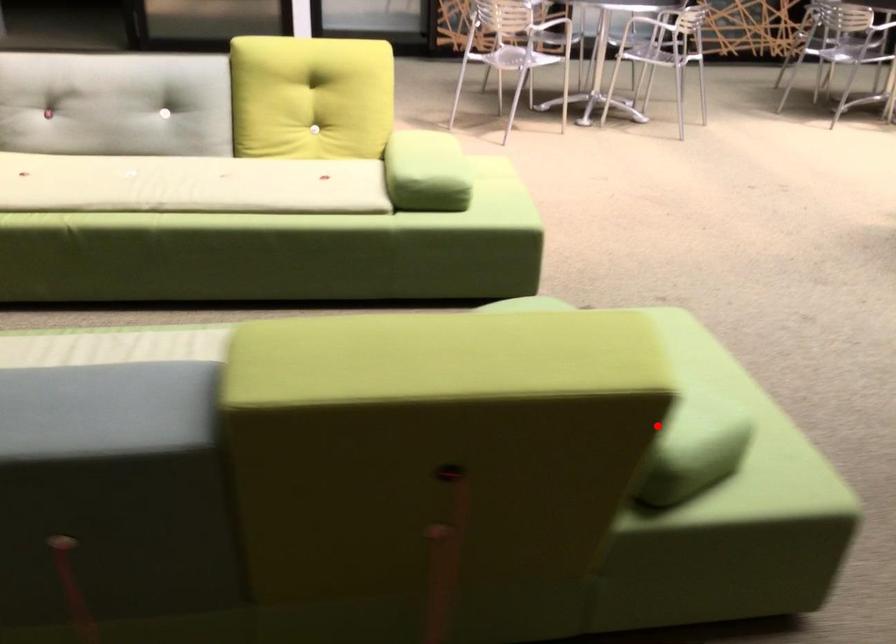
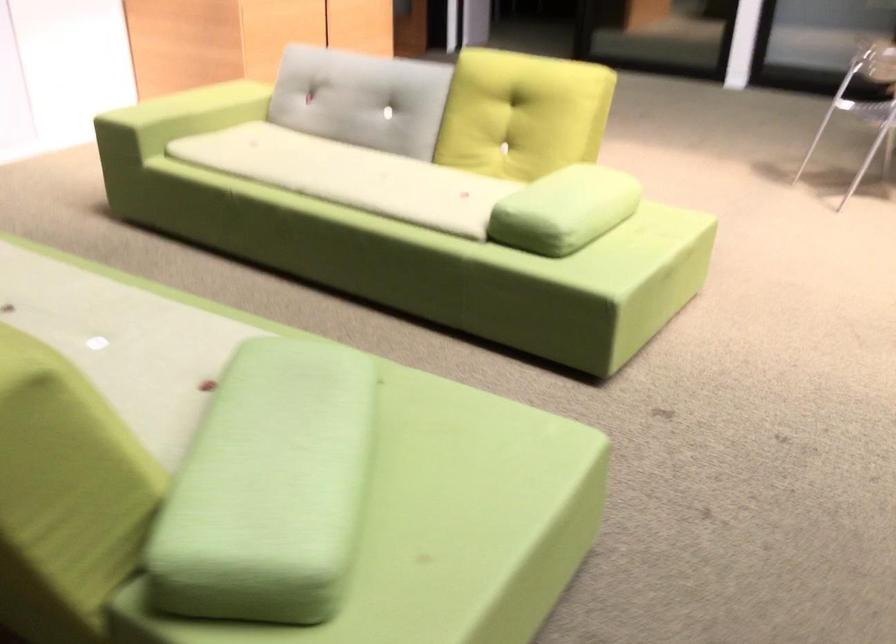
The point at the highlighted location is marked in the first image. Where is the corresponding point in the second image?

(64, 497)